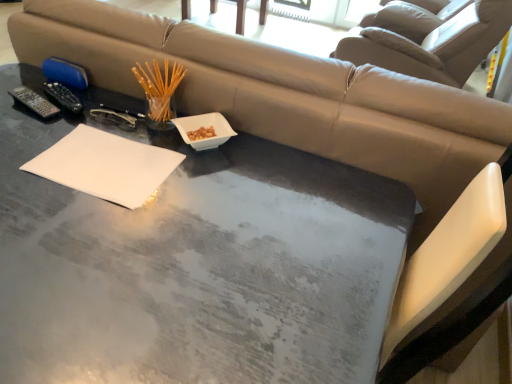
In order to click on free space to the right of white matte notepad at center in this screenshot , I will do coord(217,191).